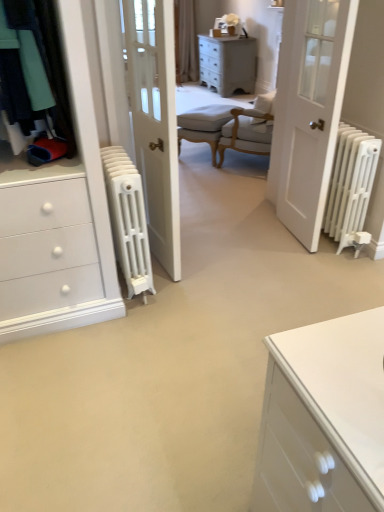
What are the coordinates of `free space in front of white matte radiator at right, the 1th radiator viewed from the right` in the screenshot? It's located at (339, 271).